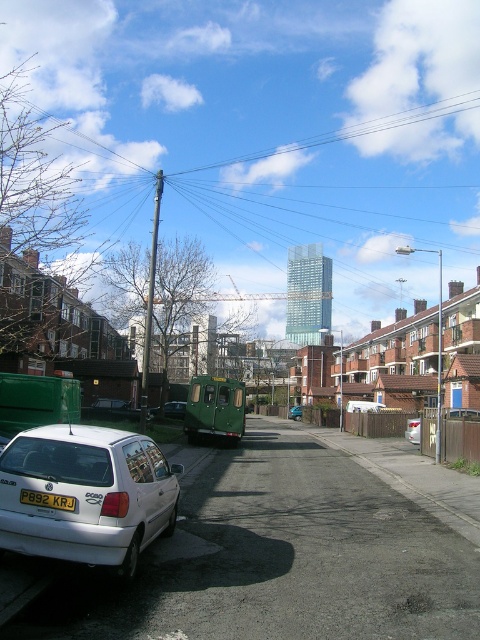
Who is more distant from viewer, (167, 406) or (300, 404)?

Positioned behind is point (300, 404).

What are the coordinates of `metallic silver car at center` in the screenshot? It's located at (173, 410).

Identify the location of white matte hatchback at lower left. (86, 493).

Locate an element on the screen. This screenshot has width=480, height=640. white matte hatchback at lower left is located at coordinates (86, 493).

Who is more forward, [154,410] or [419,428]?

Point [419,428]

Between metallic silver car at center and white matte car at center, which one has more height?

white matte car at center

Between point (170, 401) and point (407, 422), which one is positioned behind?

Positioned behind is point (170, 401).

Locate an element on the screen. metallic silver car at center is located at coordinates (173, 410).